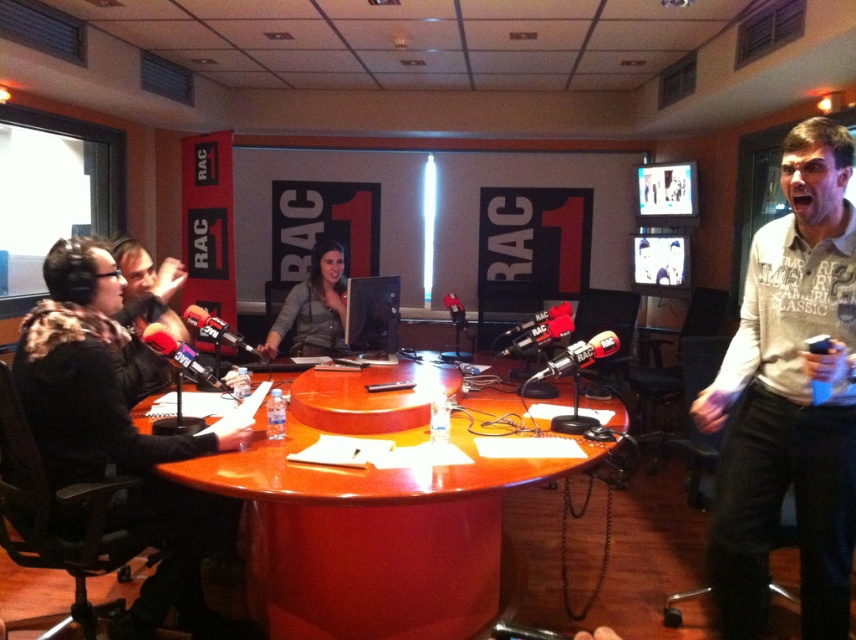
Which is more to the left, matte black microphone at center or black matte microphone at center?

matte black microphone at center is more to the left.

Which is below, matte black microphone at center or black matte microphone at center?

black matte microphone at center is below.

Find the location of `matte black microphone at center`. matte black microphone at center is located at coordinates (185, 358).

Is white cotton shirt at right thinner than metallic black microphone at center?

Incorrect, white cotton shirt at right's width is not less than metallic black microphone at center's.

Can you confirm if white cotton shirt at right is shorter than metallic black microphone at center?

No, white cotton shirt at right is not shorter than metallic black microphone at center.

The width and height of the screenshot is (856, 640). In order to click on white cotton shirt at right in this screenshot , I will do `click(789, 397)`.

Can you confirm if matte black microphone at left is positioned to the left of matte black microphone at center?

Yes, matte black microphone at left is to the left of matte black microphone at center.

Who is more forward, (140, 288) or (165, 339)?

Point (165, 339) is in front.

You are a GUI agent. You are given a task and a screenshot of the screen. Output one action in this format:
    pyautogui.click(x=<x>, y=<y>)
    Task: Click on the matte black microphone at left
    Image resolution: width=856 pixels, height=640 pixels.
    Given the screenshot: What is the action you would take?
    pyautogui.click(x=134, y=268)